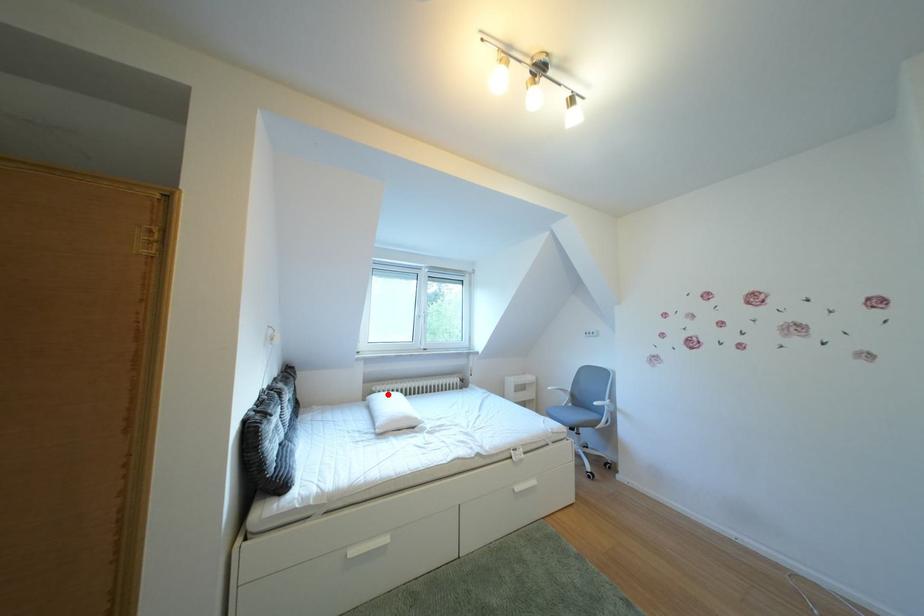
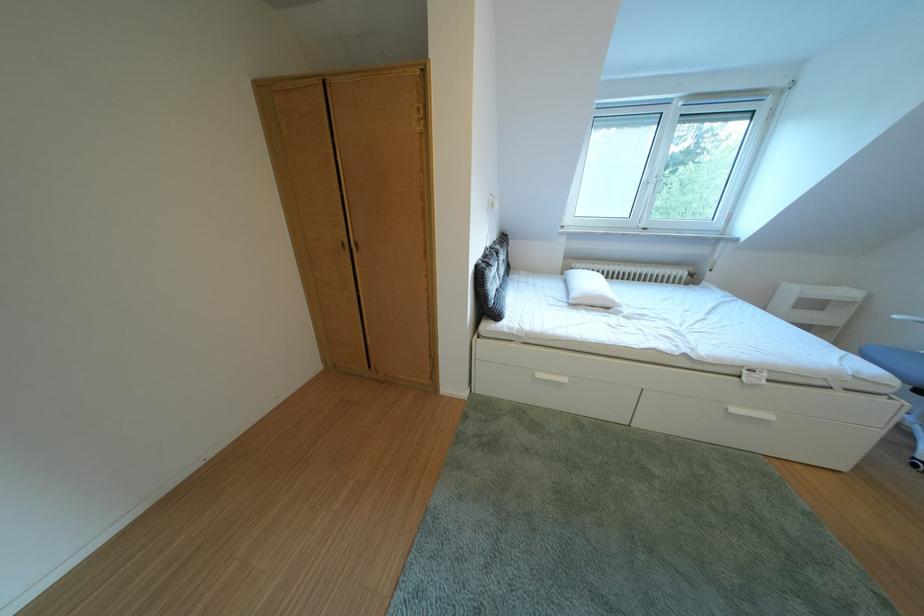
The point at the highlighted location is marked in the first image. Where is the corresponding point in the second image?

(588, 270)